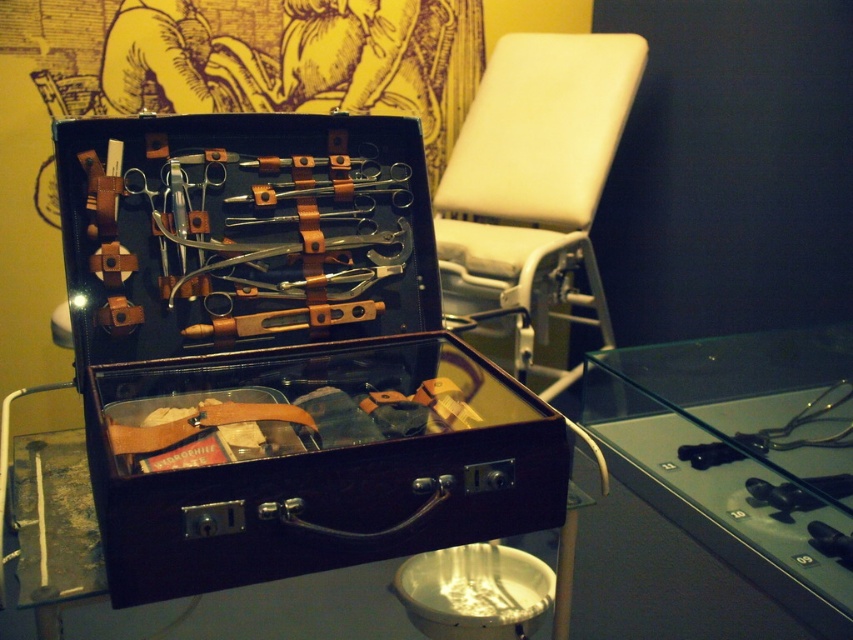
You are a museum visitor standing in front of the vintage medical tool kit. You notice the transparent glass case at center and the metallic silver scissors at center. Which object is positioned to the left of the other?

The transparent glass case at center is to the left of the metallic silver scissors at center.

You are a museum visitor holding a 12 inch ruler. You want to measure the distance between yourself and the transparent glass case at center. Can you accurately measure it with your ruler?

The transparent glass case at center is 29.51 inches away from the camera. Since your ruler is only 12 inches long, it is not long enough to measure the full distance. You would need a longer measuring tool.

You are a museum curator planning to display both the leather suitcase at center and the transparent glass case at center side by side. Which one should you place on the left to ensure they fit within the 1.2 meter wide display shelf?

The leather suitcase at center is wider than the transparent glass case at center, so placing the leather suitcase at center on the left would utilize the space more effectively, ensuring both fit within the 1.2 meter wide display shelf.